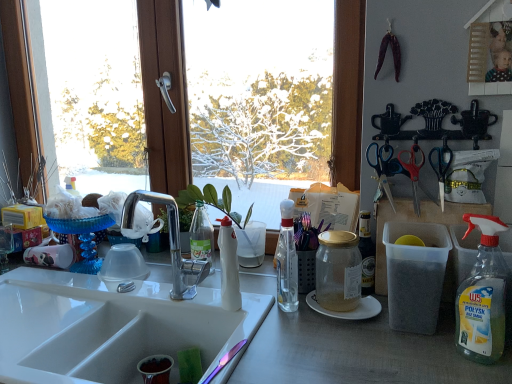
Where is `free point behind white matte bottle at center, which appears as the first bottle when viewed from the left`? The image size is (512, 384). free point behind white matte bottle at center, which appears as the first bottle when viewed from the left is located at coordinates (243, 286).